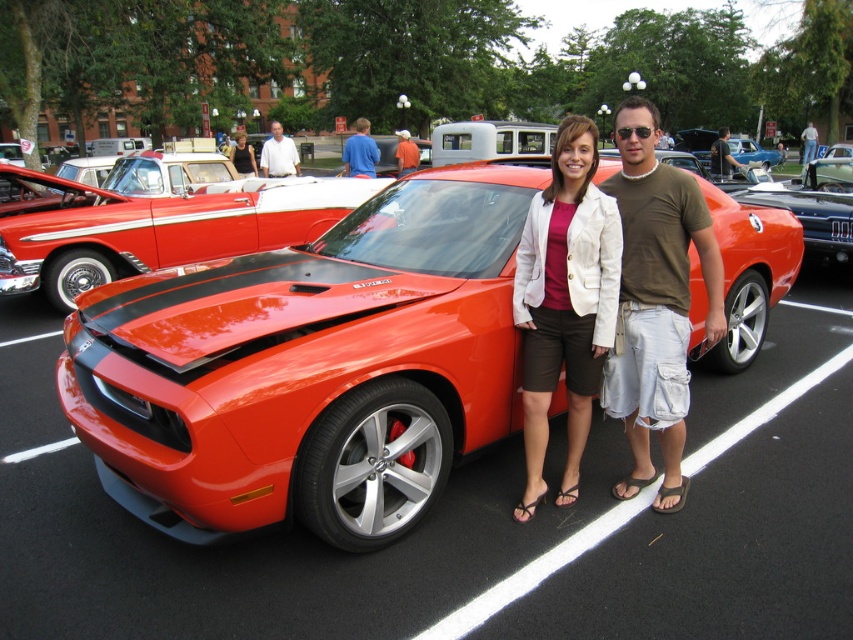
Question: Considering the relative positions of glossy black car at center and dark brown leather jacket at center in the image provided, where is glossy black car at center located with respect to dark brown leather jacket at center?

Choices:
 (A) left
 (B) right

Answer: (A)

Question: Which point appears closest to the camera in this image?

Choices:
 (A) (404, 164)
 (B) (241, 170)

Answer: (B)

Question: Can you confirm if white smooth shirt at center is positioned to the right of matte black tank top at center?

Choices:
 (A) yes
 (B) no

Answer: (B)

Question: Is matte black tank top at center thinner than matte orange shirt at center?

Choices:
 (A) yes
 (B) no

Answer: (B)

Question: Which point appears closest to the camera in this image?

Choices:
 (A) (653, 240)
 (B) (825, 161)

Answer: (A)

Question: Among these objects, which one is nearest to the camera?

Choices:
 (A) white smooth shirt at center
 (B) matte white blazer at center
 (C) shiny orange car at center

Answer: (B)